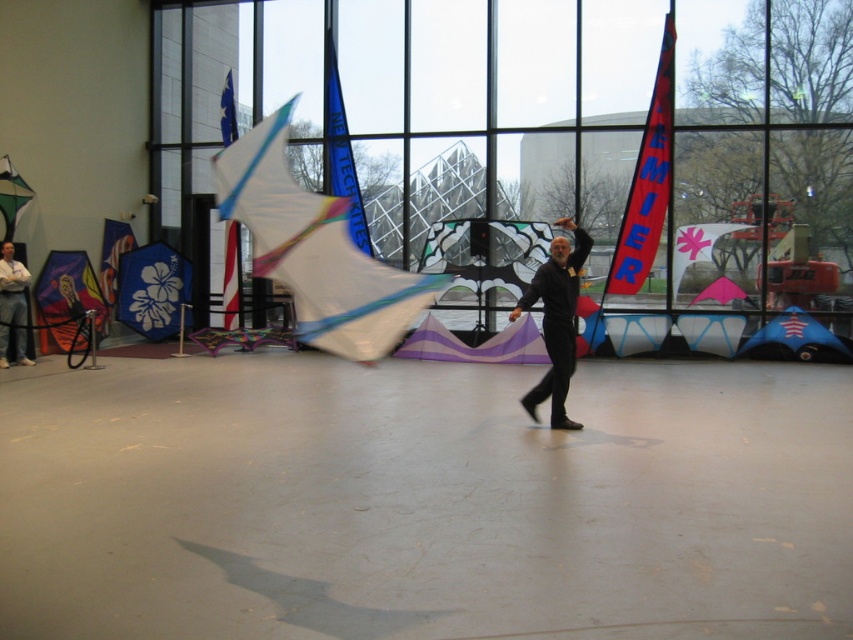
Question: Is transparent glass window at center thinner than denim jeans at left?

Choices:
 (A) no
 (B) yes

Answer: (A)

Question: Is transparent glass window at center above translucent white kite at center?

Choices:
 (A) no
 (B) yes

Answer: (B)

Question: Can you confirm if transparent glass window at center is positioned below denim jeans at left?

Choices:
 (A) yes
 (B) no

Answer: (B)

Question: Which point is farther to the camera?

Choices:
 (A) black matte pants at center
 (B) translucent white kite at center
 (C) transparent glass window at center

Answer: (C)

Question: Among these points, which one is farthest from the camera?

Choices:
 (A) (692, 60)
 (B) (291, 102)

Answer: (A)

Question: Which object is closer to the camera taking this photo?

Choices:
 (A) denim jeans at left
 (B) black matte pants at center

Answer: (B)